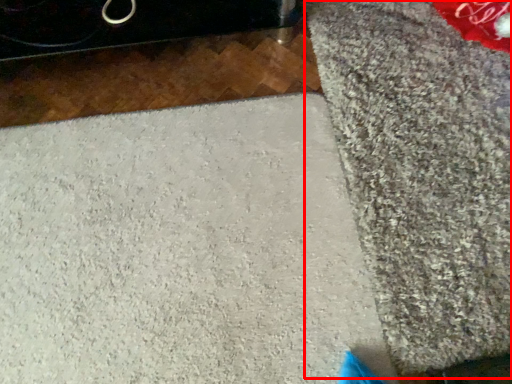
Question: In this image, where is mat (annotated by the red box) located relative to concrete?

Choices:
 (A) right
 (B) left

Answer: (A)